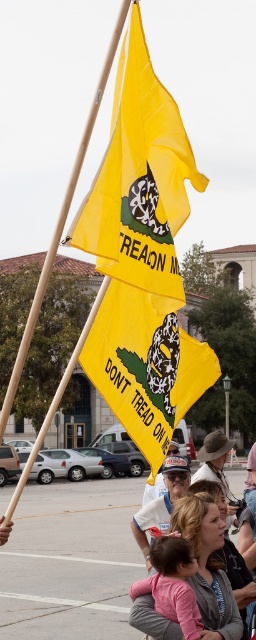
You are a photographer trying to capture the yellow fabric flag at upper center in your shot. Given that your camera has a focal point at coordinates 0.3, 0.5, will the flag be centered in your photo?

The yellow fabric flag at upper center is located at point (139, 179), which is very close to the camera focal point at (128, 192). The slight difference in coordinates means the flag will be nearly centered but slightly to the left and above the exact center of the photo.

You are a photographer trying to capture both the wooden pole at upper center and the white paper hat at center in a single frame. Based on their positions, which object should you position closer to the left side of your camera viewfinder?

A: The wooden pole at upper center is to the left of the white paper hat at center, so you should position the wooden pole at upper center closer to the left side of your camera viewfinder.